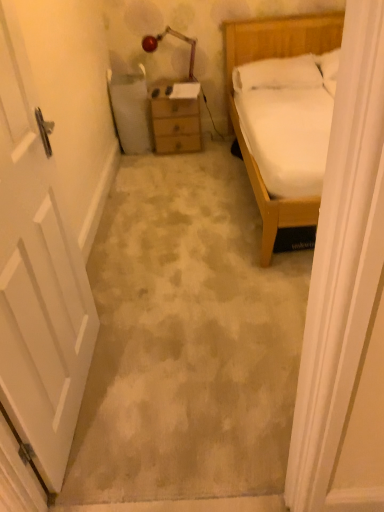
Image resolution: width=384 pixels, height=512 pixels. I want to click on vacant area that is in front of wooden chest of drawers at center, so click(x=180, y=163).